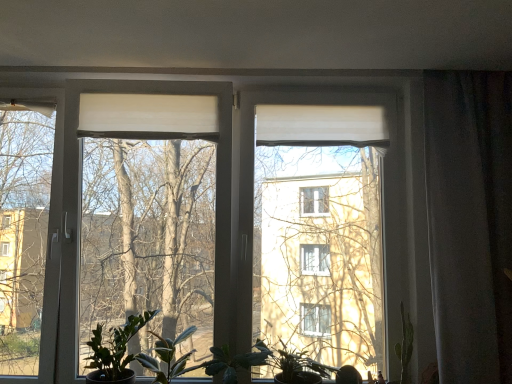
Question: From the image's perspective, is green matte plant at lower left, which appears as the 3th houseplant when viewed from the right, under green matte leafy plant at center?

Choices:
 (A) yes
 (B) no

Answer: (B)

Question: From a real-world perspective, does green matte plant at lower left, the first houseplant in the left-to-right sequence, stand above green matte leafy plant at center?

Choices:
 (A) no
 (B) yes

Answer: (B)

Question: Is green matte plant at lower left, which appears as the 3th houseplant when viewed from the right, to the right of green matte leafy plant at center from the viewer's perspective?

Choices:
 (A) yes
 (B) no

Answer: (B)

Question: Is green matte plant at lower left, the first houseplant in the left-to-right sequence, shorter than green matte leafy plant at center?

Choices:
 (A) no
 (B) yes

Answer: (A)

Question: Can you confirm if green matte plant at lower left, the first houseplant in the left-to-right sequence, is taller than green matte leafy plant at center?

Choices:
 (A) yes
 (B) no

Answer: (A)

Question: From a real-world perspective, is green matte plant at lower left, the first houseplant in the left-to-right sequence, positioned above or below green matte plant at lower center, marked as the first houseplant in a right-to-left arrangement?

Choices:
 (A) above
 (B) below

Answer: (A)

Question: Looking at their shapes, would you say green matte plant at lower left, which appears as the 3th houseplant when viewed from the right, is wider or thinner than green matte plant at lower center, marked as the first houseplant in a right-to-left arrangement?

Choices:
 (A) thin
 (B) wide

Answer: (A)

Question: In terms of size, does green matte plant at lower left, which appears as the 3th houseplant when viewed from the right, appear bigger or smaller than green matte plant at lower center, the third houseplant viewed from the left?

Choices:
 (A) small
 (B) big

Answer: (A)

Question: Is point (109, 329) closer or farther from the camera than point (285, 345)?

Choices:
 (A) farther
 (B) closer

Answer: (A)

Question: Considering the positions of green matte leafy plant at center and green matte leafy plant at lower center, arranged as the 2th houseplant when viewed from the right, in the image, is green matte leafy plant at center bigger or smaller than green matte leafy plant at lower center, arranged as the 2th houseplant when viewed from the right,?

Choices:
 (A) small
 (B) big

Answer: (A)

Question: In terms of width, does green matte leafy plant at center look wider or thinner when compared to green matte leafy plant at lower center, arranged as the 2th houseplant when viewed from the right?

Choices:
 (A) thin
 (B) wide

Answer: (B)

Question: From the image's perspective, relative to green matte leafy plant at lower center, the 2th houseplant in the left-to-right sequence, is green matte leafy plant at center above or below?

Choices:
 (A) above
 (B) below

Answer: (B)

Question: From a real-world perspective, is green matte leafy plant at center physically located above or below green matte leafy plant at lower center, arranged as the 2th houseplant when viewed from the right?

Choices:
 (A) below
 (B) above

Answer: (A)

Question: Based on their sizes in the image, would you say green matte leafy plant at lower center, the 2th houseplant in the left-to-right sequence, is bigger or smaller than green matte leafy plant at center?

Choices:
 (A) big
 (B) small

Answer: (A)

Question: Choose the correct answer: Is green matte leafy plant at lower center, arranged as the 2th houseplant when viewed from the right, inside green matte leafy plant at center or outside it?

Choices:
 (A) outside
 (B) inside

Answer: (A)